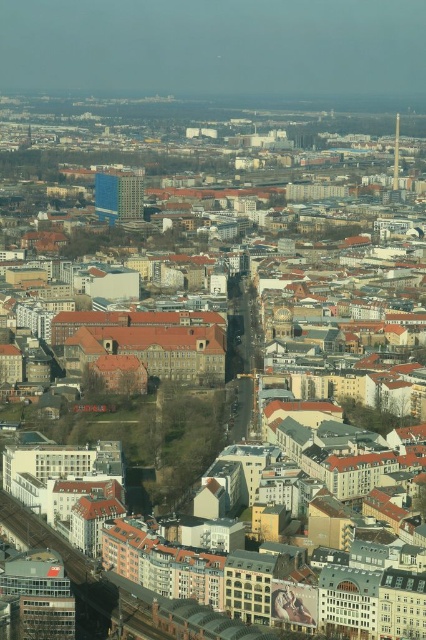
Is blue glass building at center positioned behind metallic silver tower at upper right?

No, blue glass building at center is in front of metallic silver tower at upper right.

The height and width of the screenshot is (640, 426). Describe the element at coordinates (118, 195) in the screenshot. I see `blue glass building at center` at that location.

Which is behind, point (120, 177) or point (394, 156)?

The point (394, 156) is more distant.

You are a GUI agent. You are given a task and a screenshot of the screen. Output one action in this format:
    pyautogui.click(x=<x>, y=<y>)
    Task: Click on the blue glass building at center
    The image size is (426, 640).
    Given the screenshot: What is the action you would take?
    pyautogui.click(x=118, y=195)